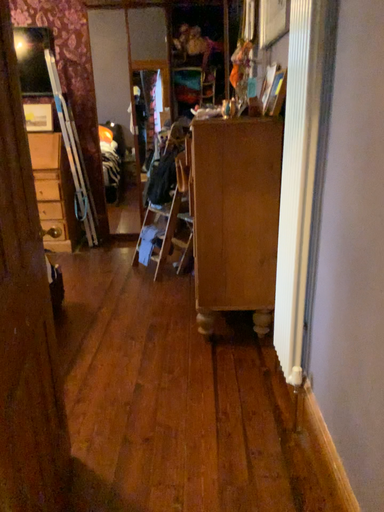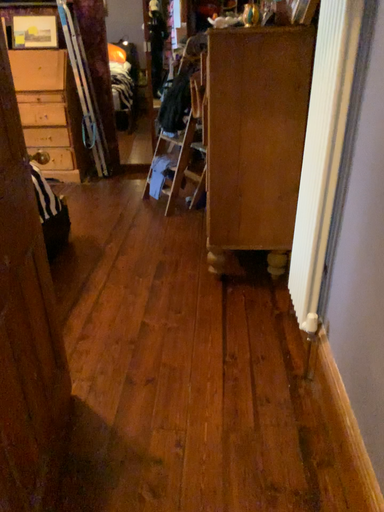
Question: How did the camera likely rotate when shooting the video?

Choices:
 (A) rotated upward
 (B) rotated downward

Answer: (B)